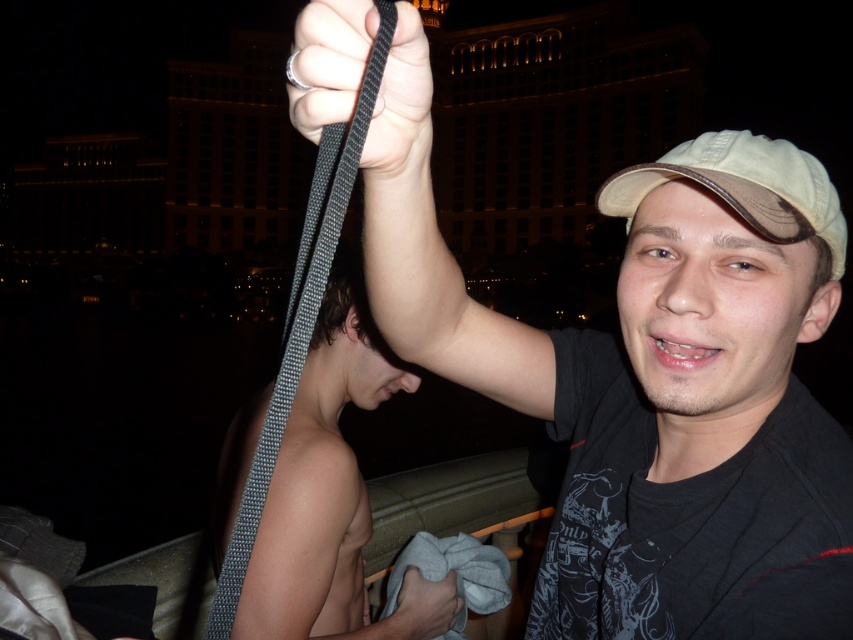
Question: Which point appears closest to the camera in this image?

Choices:
 (A) (318, 193)
 (B) (283, 556)
 (C) (839, 209)

Answer: (A)

Question: Does black textured strap at upper center have a larger size compared to gray fabric at upper center?

Choices:
 (A) yes
 (B) no

Answer: (A)

Question: Does matte black strap at upper center appear over gray fabric at upper center?

Choices:
 (A) no
 (B) yes

Answer: (B)

Question: Which point is closer to the camera?

Choices:
 (A) white fabric cap at upper center
 (B) black woven strap at upper center

Answer: (B)

Question: Is black woven strap at upper center further to the viewer compared to gray fabric at upper center?

Choices:
 (A) no
 (B) yes

Answer: (A)

Question: Which point is farther to the camera?

Choices:
 (A) gray fabric at upper center
 (B) black woven strap at upper center
 (C) gray woven strap at upper center

Answer: (A)